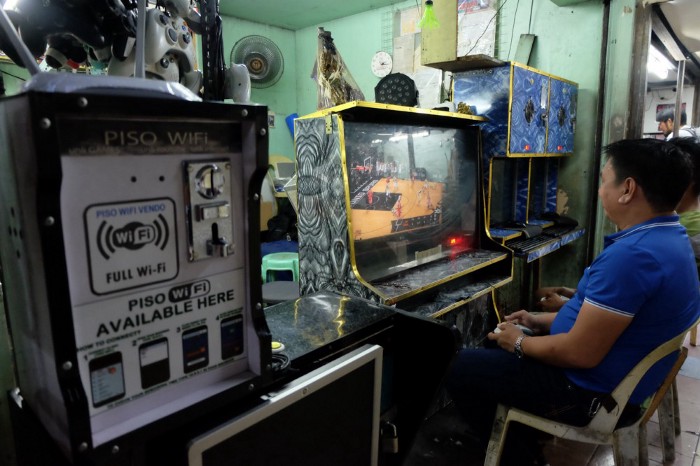
Image resolution: width=700 pixels, height=466 pixels. Identify the location of fan. (267, 53).